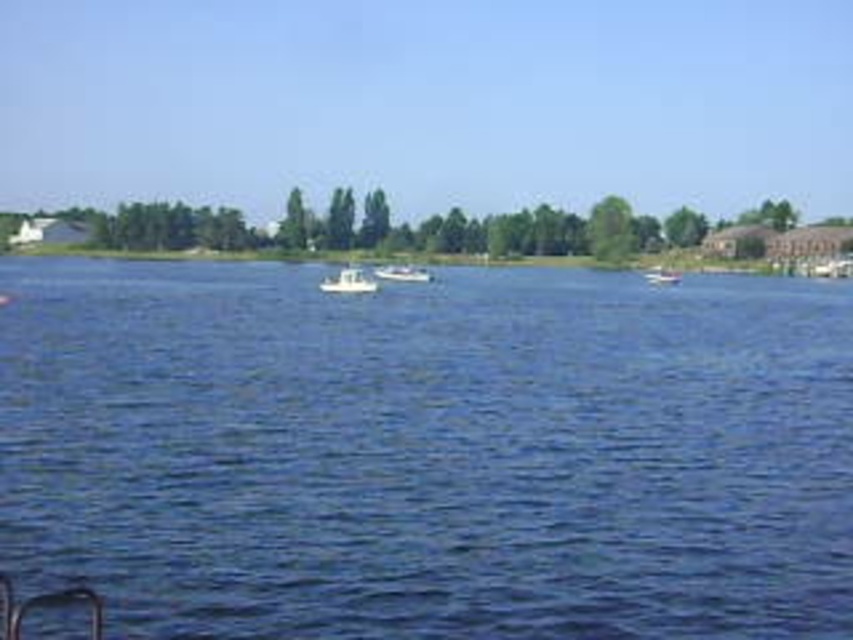
Question: Does white plastic boat at center appear on the left side of white matte boat at center?

Choices:
 (A) yes
 (B) no

Answer: (A)

Question: Can you confirm if blue liquid water at center is thinner than white matte boat at center?

Choices:
 (A) no
 (B) yes

Answer: (A)

Question: Does white plastic boat at center appear over white matte boat at right?

Choices:
 (A) yes
 (B) no

Answer: (A)

Question: Which object appears closest to the camera in this image?

Choices:
 (A) blue liquid water at center
 (B) white matte boat at right

Answer: (A)

Question: Which point appears farthest from the camera in this image?

Choices:
 (A) (332, 376)
 (B) (399, 275)

Answer: (B)

Question: Which object is closer to the camera taking this photo?

Choices:
 (A) white matte boat at right
 (B) blue liquid water at center
 (C) white plastic boat at center

Answer: (B)